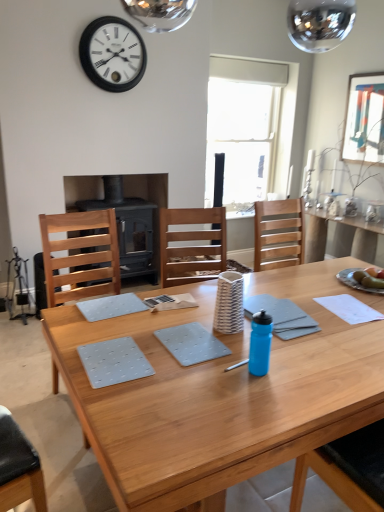
This screenshot has height=512, width=384. In order to click on free spot to the left of green matte apple at center in this screenshot , I will do `click(340, 287)`.